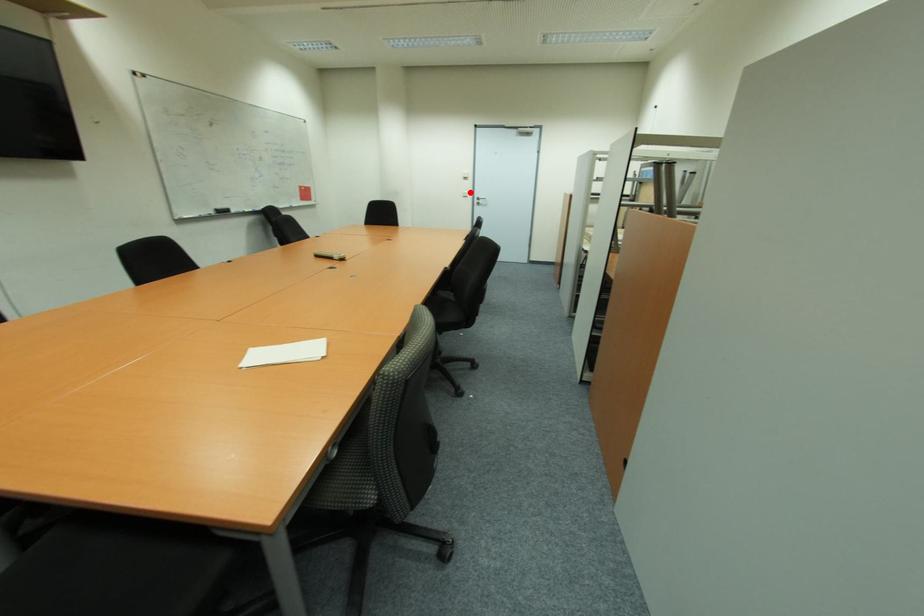
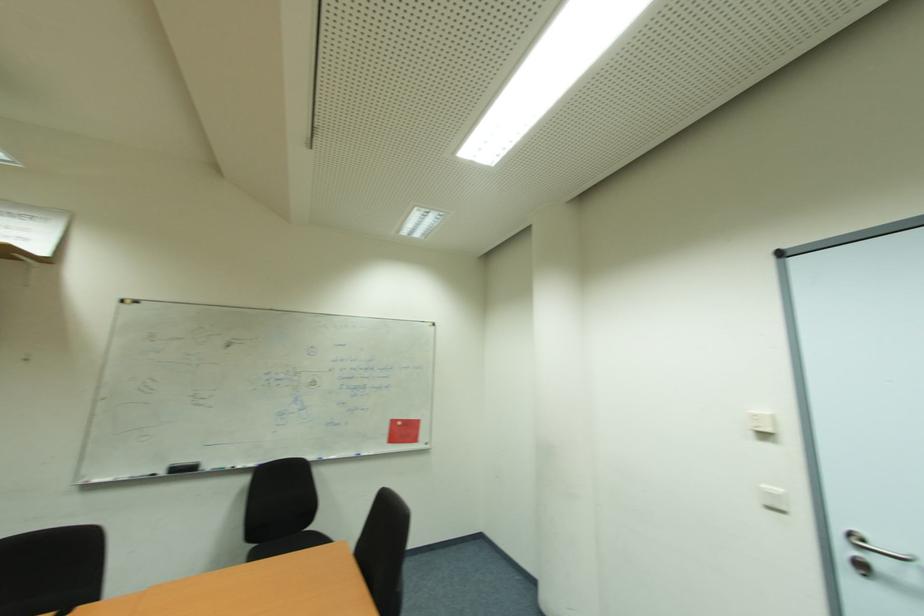
In the second image, find the point that corresponds to the highlighted location in the first image.

(784, 492)